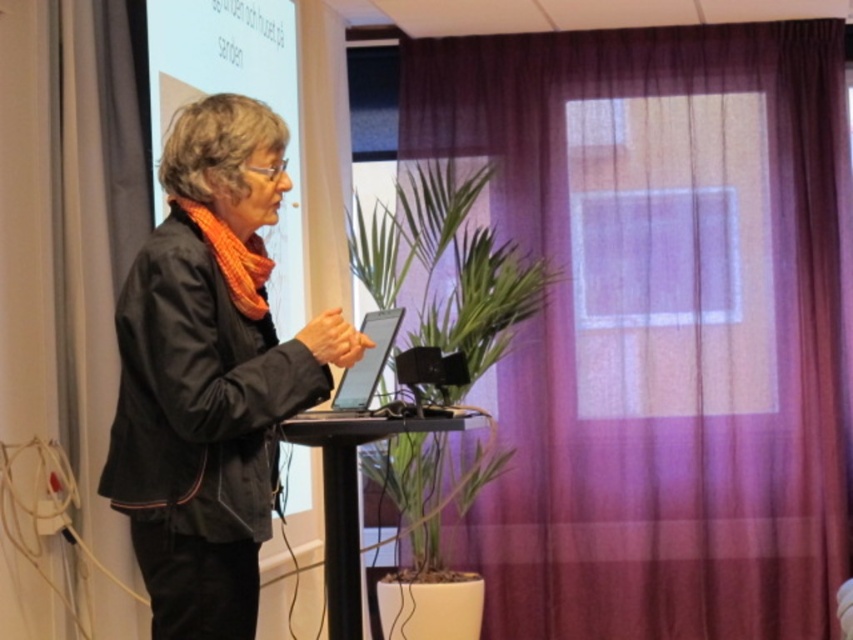
You are attending a seminar and want to move from the black matte jacket at left to the purple sheer curtain at center. Which direction should you move in?

The purple sheer curtain at center is positioned on the right side of the black matte jacket at left, so you should move to the right to reach it.

You are an attendee sitting in the front row of the conference. You want to reach the purple sheer curtain at center to adjust the lighting. Considering your height is 1.7 meters, can you comfortably reach it without standing on anything?

The purple sheer curtain at center is 4.81 meters away from the viewer. Since the distance is quite far, it would be difficult to reach comfortably without moving closer or using assistance.

You are a photographer positioned in front of the podium. You want to capture a clear photo of the orange knitted scarf at left and the purple sheer curtain at center. Which object should you focus on first to ensure both are in focus?

The orange knitted scarf at left is behind the purple sheer curtain at center, so you should focus on the orange knitted scarf at left first to ensure both are in focus.